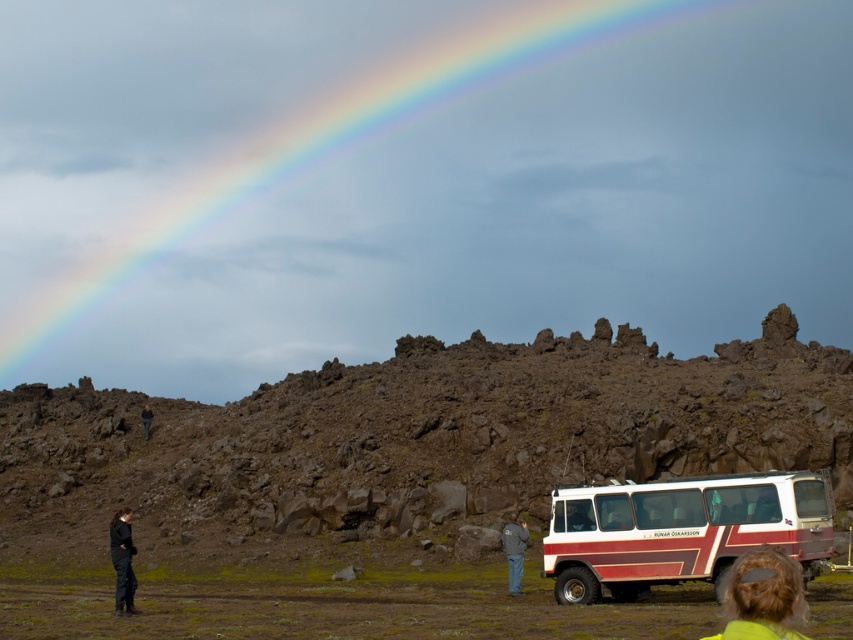
You are a photographer trying to capture the rainbow at upper center and dark gray pants at left in the same frame. Based on their sizes, which one would appear larger in your photo?

The rainbow at upper center is wider than dark gray pants at left, so it would appear larger in the photo.

In the scene shown: You are a photographer trying to capture the rainbow in the image. You notice the light brown hair at lower right and dark gray pants at left. Which object is positioned closer to the camera, and why?

The light brown hair at lower right is closer to the viewer than dark gray pants at left because it is positioned nearer in the scene.